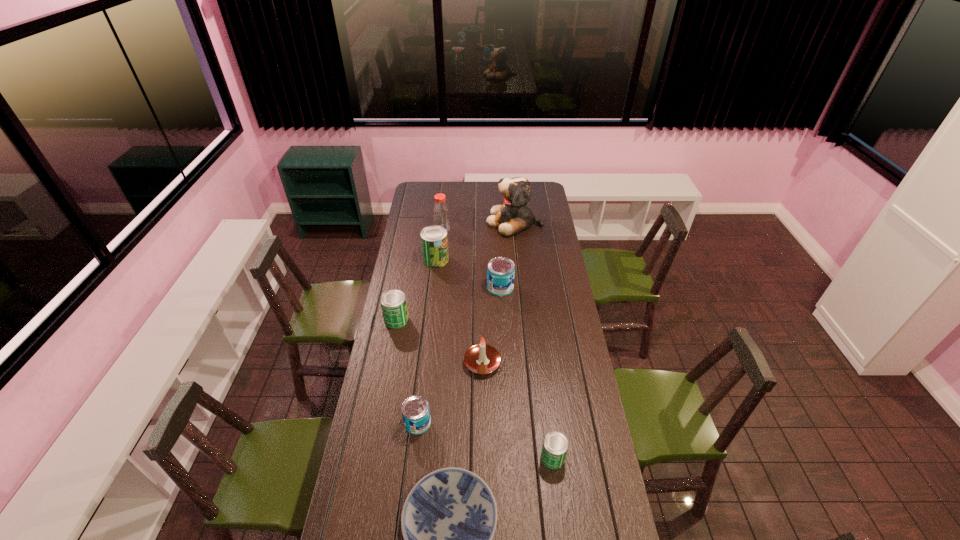
Locate an element on the screen. This screenshot has height=540, width=960. puppy is located at coordinates [512, 217].

At what (x,y) coordinates should I click in order to perform the action: click on bottle. Please return your answer as a coordinate pair (x, y). Looking at the image, I should click on (441, 217).

Identify the location of the second tallest object. The image size is (960, 540). (441, 217).

This screenshot has height=540, width=960. Find the location of `the second green can from right to left`. the second green can from right to left is located at coordinates click(434, 242).

Image resolution: width=960 pixels, height=540 pixels. I want to click on the farthest green can, so click(x=434, y=242).

The width and height of the screenshot is (960, 540). Identify the location of candle. (482, 359).

Where is `white candle`? The width and height of the screenshot is (960, 540). white candle is located at coordinates (482, 359).

This screenshot has height=540, width=960. I want to click on the right blue can, so click(x=500, y=271).

I want to click on the fourth can from left to right, so pos(500,271).

In order to click on the second smallest green can in this screenshot , I will do `click(393, 303)`.